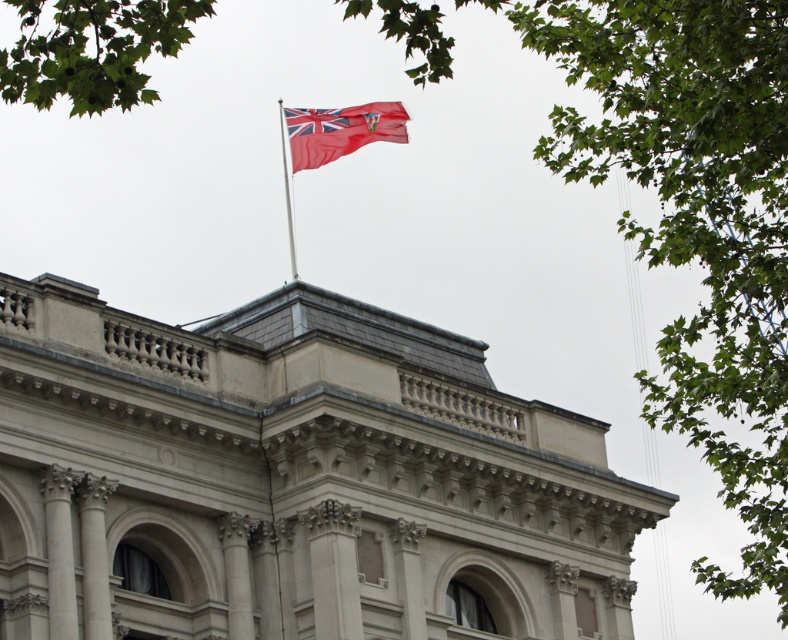
Consider the image. Is red fabric flag at upper center closer to the viewer compared to silver metallic flag pole at upper center?

Yes, red fabric flag at upper center is closer to the viewer.

Can you confirm if red fabric flag at upper center is positioned to the left of silver metallic flag pole at upper center?

Incorrect, red fabric flag at upper center is not on the left side of silver metallic flag pole at upper center.

Which is behind, point (316, 109) or point (277, 106)?

Point (277, 106)

Locate an element on the screen. red fabric flag at upper center is located at coordinates (340, 131).